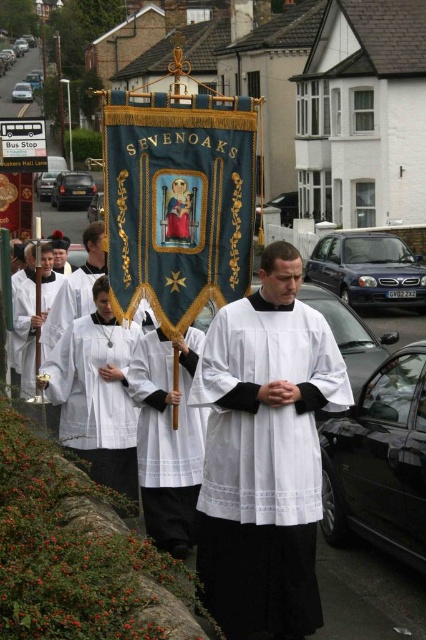
From the picture: Is white cotton robe at center smaller than white matte robe at center?

No.

Is point (203, 544) positioned in front of point (132, 339)?

Yes, it is.

Locate an element on the screen. The width and height of the screenshot is (426, 640). white cotton robe at center is located at coordinates (264, 452).

Which is above, white cotton robe at center or white matte/soft fabric robe at center?

white cotton robe at center

Who is shorter, white cotton robe at center or white matte/soft fabric robe at center?

Standing shorter between the two is white matte/soft fabric robe at center.

Does point (278, 609) come closer to viewer compared to point (184, 552)?

That is True.

You are a GUI agent. You are given a task and a screenshot of the screen. Output one action in this format:
    pyautogui.click(x=<x>, y=<y>)
    Task: Click on the white cotton robe at center
    The height and width of the screenshot is (640, 426).
    Given the screenshot: What is the action you would take?
    pyautogui.click(x=264, y=452)

Does white smooth fabric at center have a lesser width compared to white matte/soft fabric robe at center?

Incorrect, white smooth fabric at center's width is not less than white matte/soft fabric robe at center's.

In the scene shown: Who is lower down, white smooth fabric at center or white matte/soft fabric robe at center?

white matte/soft fabric robe at center is lower down.

Between point (230, 513) and point (143, 356), which one is positioned in front?

Point (230, 513)

You are a GUI agent. You are given a task and a screenshot of the screen. Output one action in this format:
    pyautogui.click(x=<x>, y=<y>)
    Task: Click on the white smooth fabric at center
    
    Given the screenshot: What is the action you would take?
    pyautogui.click(x=262, y=465)